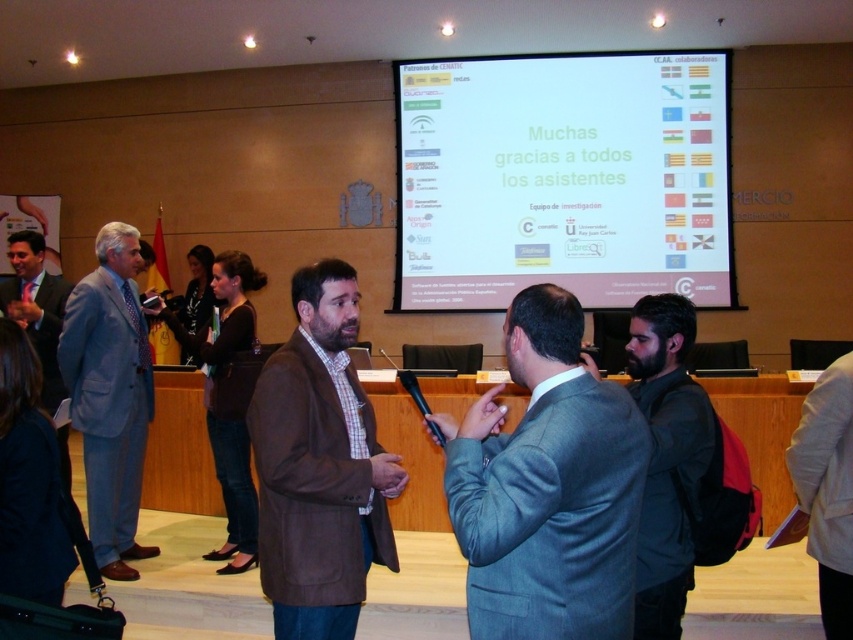
You are an event planner organizing a presentation. You need to ensure that the white matte projection screen at upper center and the gray suit at center are both visible to the audience. Given their sizes, which object will appear bigger to the audience?

The white matte projection screen at upper center will appear bigger to the audience because it is larger in size than the gray suit at center.

You are standing in the conference room and need to place a name tag on the black matte jacket at lower right. According to the coordinates provided, where exactly should you place the name tag?

The black matte jacket at lower right should have the name tag placed at point 0.717 on the x and 0.783 on the y coordinates as specified.

You are standing in the conference room and notice two points marked on the floor. The first point is at coordinate point [659,548] and the second is at point [849,442]. If you want to move towards the point that is closer to the front of the room, which coordinate should you head towards?

Point [659,548] is in front of point [849,442], so you should head towards point [659,548] to reach the front of the room.